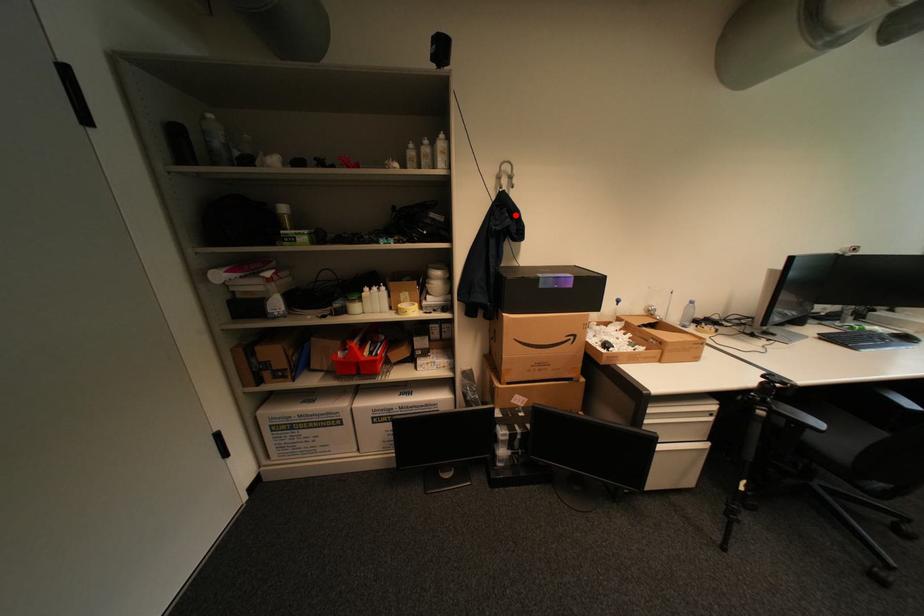
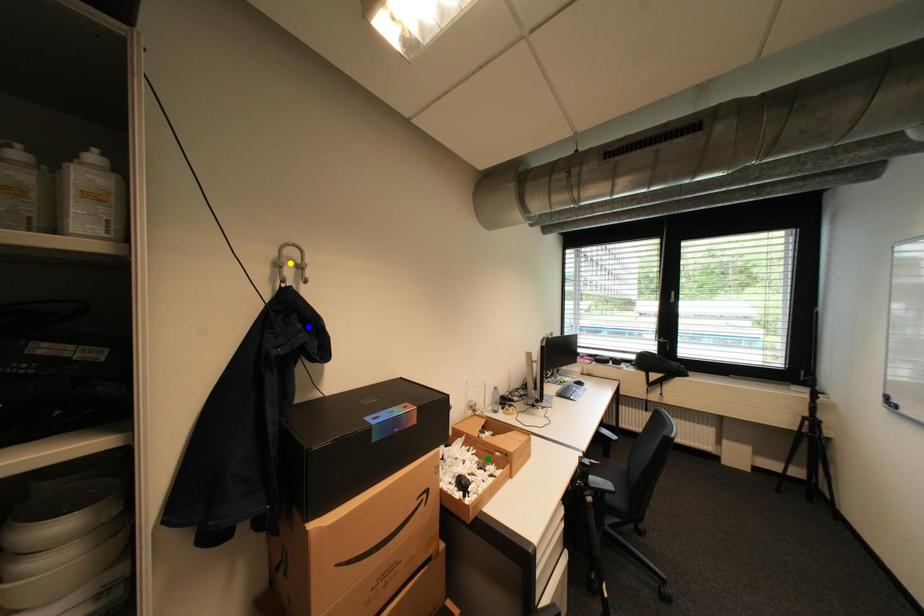
Question: I am providing you with two images of the same scene from different viewpoints. A red point is marked on the first image. You are given multiple points on the second image. Can you choose the point in image 2 that corresponds to the point in image 1?

Choices:
 (A) green point
 (B) blue point
 (C) yellow point

Answer: (B)